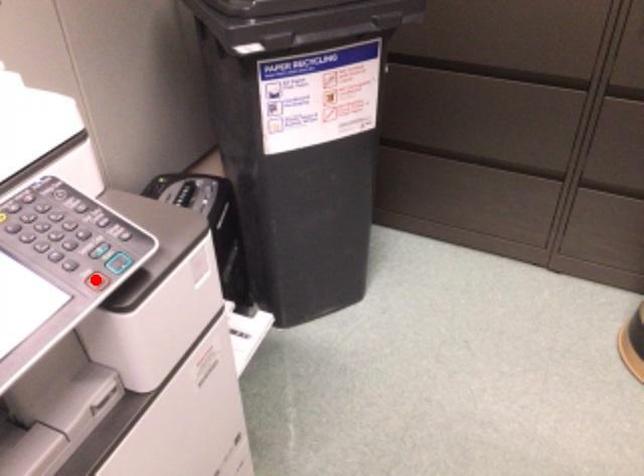
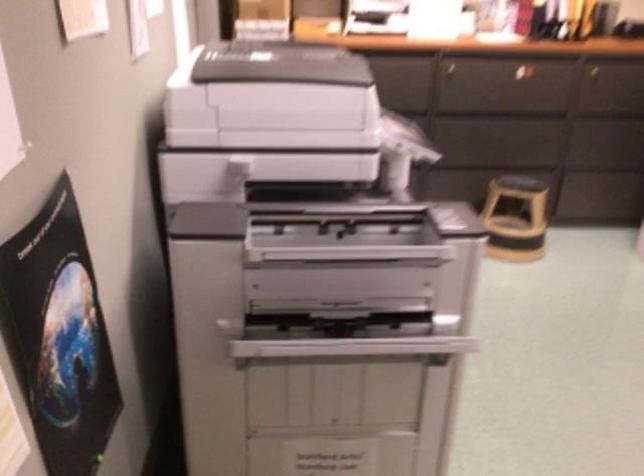
Question: I am providing you with two images of the same scene from different viewpoints. A red point is marked on the first image. Is the red point's position out of view in image 2?

Choices:
 (A) Yes
 (B) No

Answer: (A)